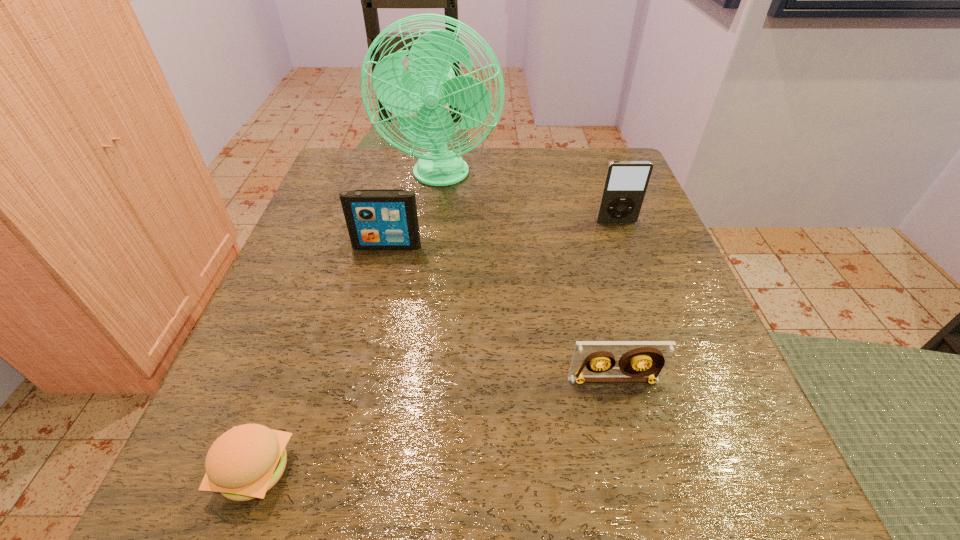
Locate an element on the screen. The image size is (960, 540). vacant area at the near right corner of the desktop is located at coordinates (776, 480).

The image size is (960, 540). I want to click on free spot between the nearest object and the third farthest object, so click(x=321, y=358).

Identify the location of free space between the right iPod and the third nearest object. The height and width of the screenshot is (540, 960). coord(502,234).

I want to click on free area in between the left iPod and the hamburger, so click(321, 358).

The height and width of the screenshot is (540, 960). Find the location of `vacant space in between the fan and the fourth farthest object`. vacant space in between the fan and the fourth farthest object is located at coordinates (527, 278).

You are a GUI agent. You are given a task and a screenshot of the screen. Output one action in this format:
    pyautogui.click(x=<x>, y=<y>)
    Task: Click on the vacant point located between the left iPod and the right iPod
    The width and height of the screenshot is (960, 540).
    Given the screenshot: What is the action you would take?
    tap(502, 234)

Find the location of a particular element. The width and height of the screenshot is (960, 540). vacant area between the second farthest object and the shortest object is located at coordinates click(x=436, y=346).

I want to click on empty location between the second shortest object and the fan, so click(x=527, y=278).

You are a GUI agent. You are given a task and a screenshot of the screen. Output one action in this format:
    pyautogui.click(x=<x>, y=<y>)
    Task: Click on the empty space between the shortest object and the farthest object
    The width and height of the screenshot is (960, 540).
    Given the screenshot: What is the action you would take?
    pyautogui.click(x=348, y=323)

Image resolution: width=960 pixels, height=540 pixels. I want to click on free space between the nearer iPod and the second shortest object, so click(x=500, y=313).